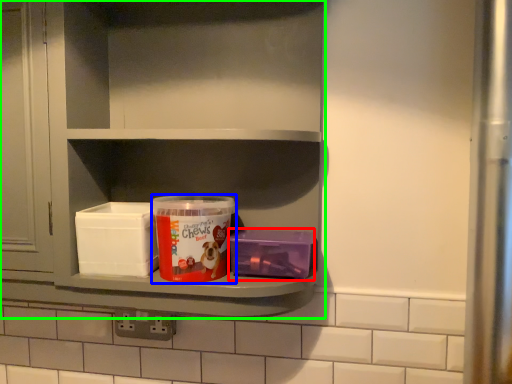
Question: Estimate the real-world distances between objects in this image. Which object is farther from box (highlighted by a red box), product (highlighted by a blue box) or shelf (highlighted by a green box)?

Choices:
 (A) product
 (B) shelf

Answer: (B)